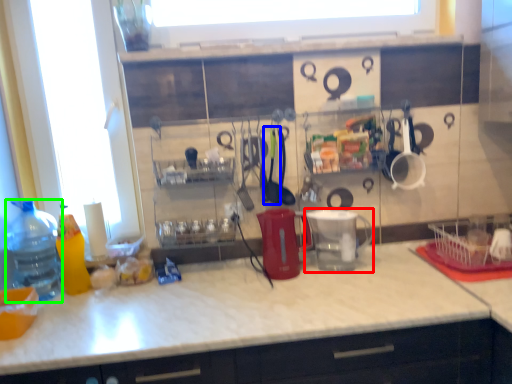
Question: Which is farther away from appliance (highlighted by a red box)? tableware (highlighted by a blue box) or bottle (highlighted by a green box)?

Choices:
 (A) tableware
 (B) bottle

Answer: (B)